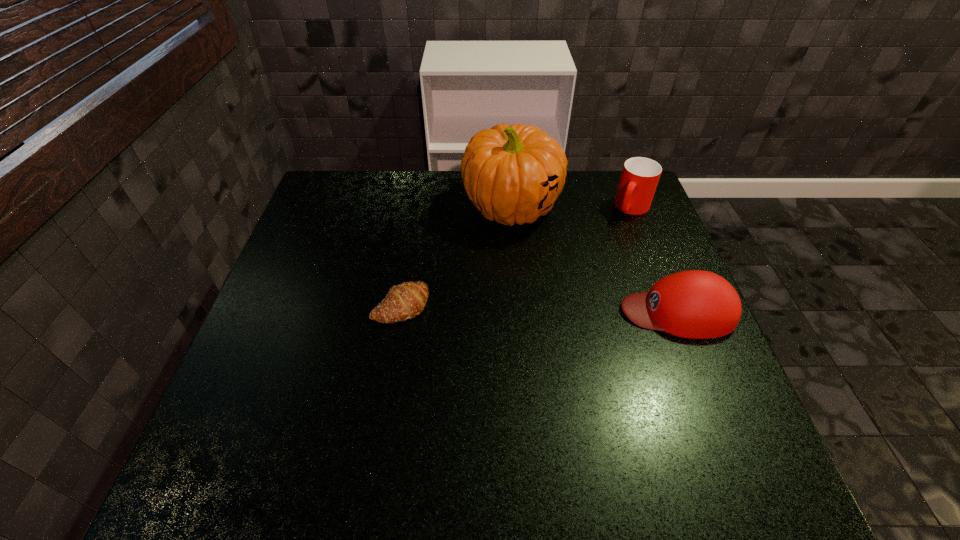
This screenshot has height=540, width=960. In order to click on free region located on the surface of the pumpkin in this screenshot , I will do (508, 262).

Identify the location of vacant space located 0.260m on the surface of the pumpkin. This screenshot has height=540, width=960. (505, 312).

This screenshot has width=960, height=540. I want to click on free space located 0.320m on the surface of the pumpkin, so click(503, 332).

You are a GUI agent. You are given a task and a screenshot of the screen. Output one action in this format:
    pyautogui.click(x=<x>, y=<y>)
    Task: Click on the vacant region located on the side of the cup with the handle
    The width and height of the screenshot is (960, 540).
    Given the screenshot: What is the action you would take?
    pyautogui.click(x=582, y=274)

I want to click on free region located on the side of the cup with the handle, so click(576, 280).

The image size is (960, 540). What are the coordinates of `vacant area situated on the side of the cup with the handle` in the screenshot? It's located at (560, 302).

The width and height of the screenshot is (960, 540). In order to click on pumpkin at the far edge in this screenshot , I will do [514, 174].

What are the coordinates of `cup located at the far edge` in the screenshot? It's located at (640, 176).

You are a GUI agent. You are given a task and a screenshot of the screen. Output one action in this format:
    pyautogui.click(x=<x>, y=<y>)
    Task: Click on the baseball cap at the right edge
    This screenshot has width=960, height=540.
    Given the screenshot: What is the action you would take?
    695,304

This screenshot has height=540, width=960. I want to click on cup present at the right edge, so click(x=640, y=176).